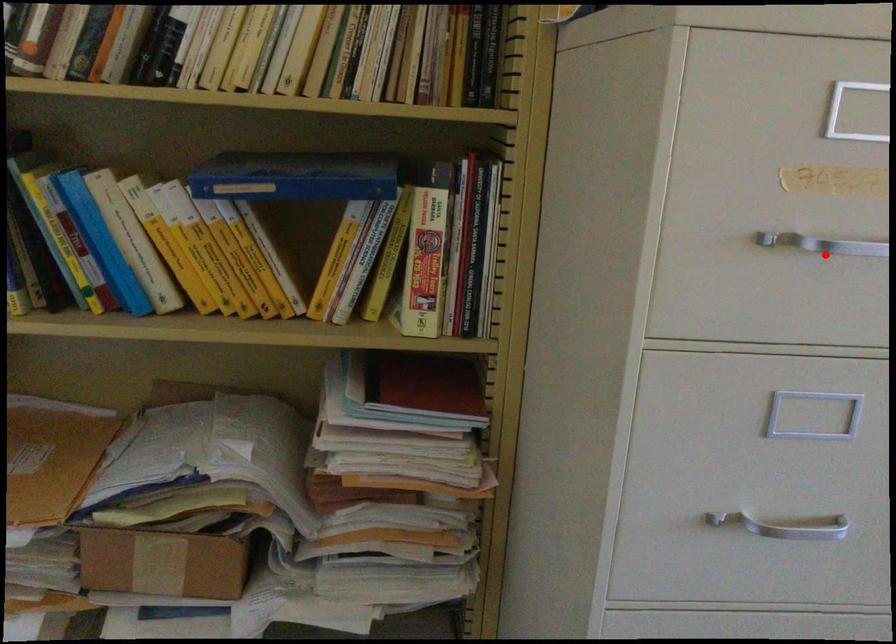
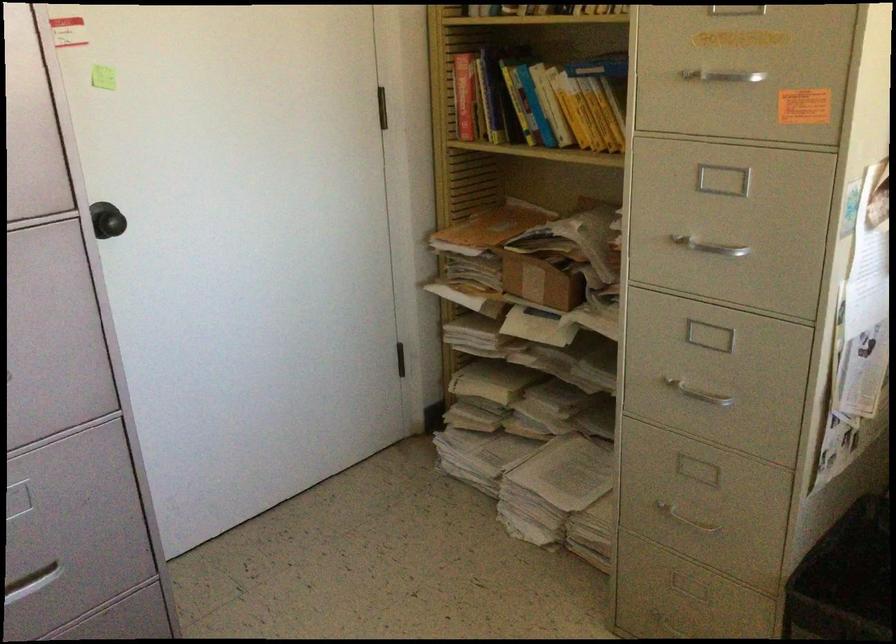
The point at the highlighted location is marked in the first image. Where is the corresponding point in the second image?

(725, 82)